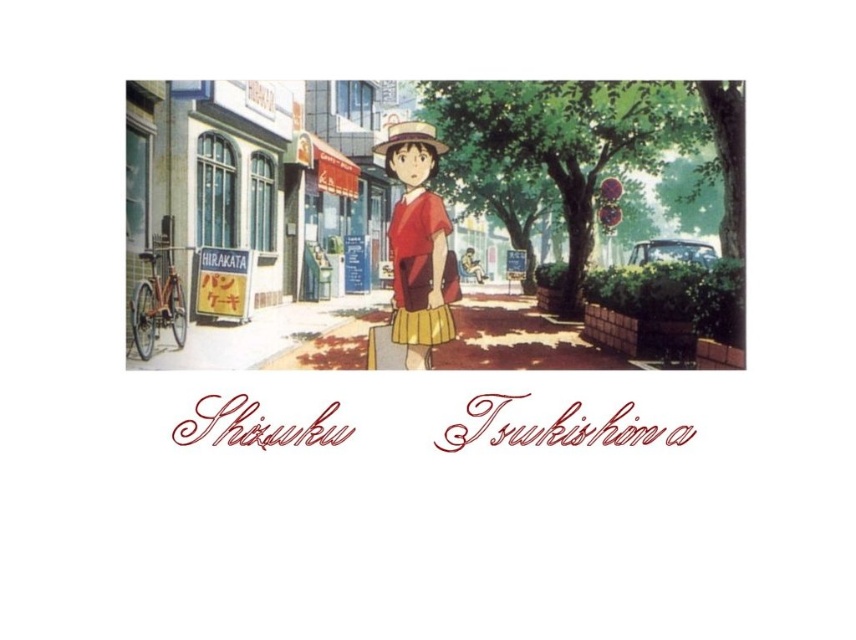
Question: Which of the following is the farthest from the observer?

Choices:
 (A) strawmaterial/texture hat at center
 (B) matte red shirt at center
 (C) yellow paper sign at left

Answer: (C)

Question: Considering the relative positions of yellow paper sign at left and strawmaterial/texture hat at center in the image provided, where is yellow paper sign at left located with respect to strawmaterial/texture hat at center?

Choices:
 (A) above
 (B) below

Answer: (B)

Question: Among these objects, which one is farthest from the camera?

Choices:
 (A) matte red shirt at center
 (B) strawmaterial/texture hat at center
 (C) yellow paper sign at left

Answer: (C)

Question: Does matte red shirt at center have a smaller size compared to yellow paper sign at left?

Choices:
 (A) yes
 (B) no

Answer: (A)

Question: Is matte red shirt at center bigger than yellow paper sign at left?

Choices:
 (A) no
 (B) yes

Answer: (A)

Question: Which of the following is the farthest from the observer?

Choices:
 (A) (431, 132)
 (B) (232, 273)

Answer: (B)